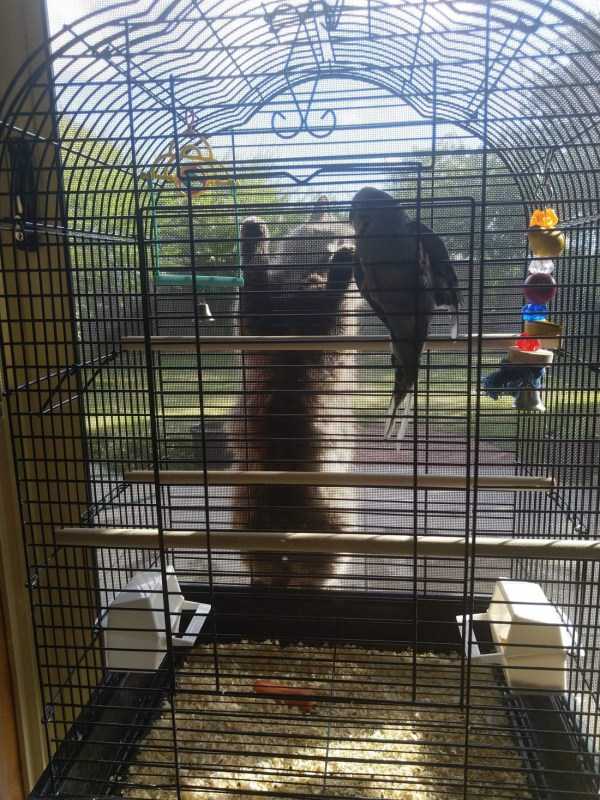
Identify the location of horizontal birdcage wooden bars. This screenshot has height=800, width=600. (294, 346), (294, 474), (319, 542).